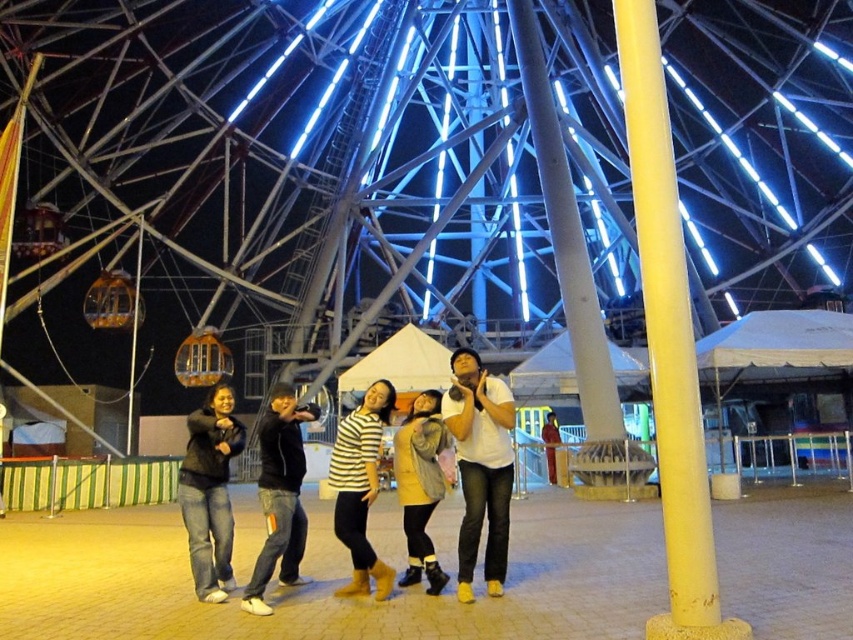
Question: Estimate the real-world distances between objects in this image. Which object is farther from the black denim jeans at center?

Choices:
 (A) yellow fuzzy coat at center
 (B) denim jeans at lower left

Answer: (A)

Question: Can you confirm if yellow matte pole at right is positioned below denim jeans at lower left?

Choices:
 (A) no
 (B) yes

Answer: (A)

Question: Is yellow matte pole at right thinner than yellow fuzzy coat at center?

Choices:
 (A) yes
 (B) no

Answer: (B)

Question: Which of these objects is positioned farthest from the denim jeans at lower left?

Choices:
 (A) black denim jeans at center
 (B) striped shirt at center

Answer: (B)

Question: Estimate the real-world distances between objects in this image. Which object is farther from the yellow fuzzy coat at center?

Choices:
 (A) yellow matte pole at right
 (B) black denim jeans at center

Answer: (A)

Question: Does denim jeans at lower left have a smaller size compared to striped shirt at center?

Choices:
 (A) yes
 (B) no

Answer: (A)